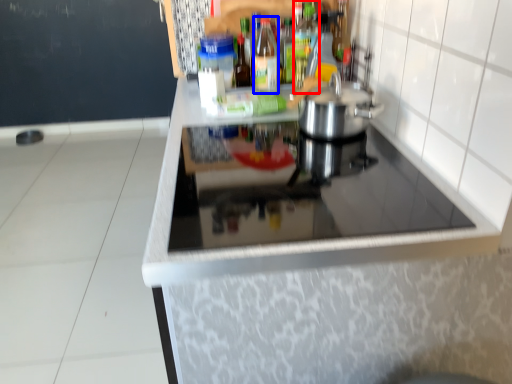
Question: Which point is further to the camera, bottle (highlighted by a red box) or bottle (highlighted by a blue box)?

Choices:
 (A) bottle
 (B) bottle

Answer: (B)